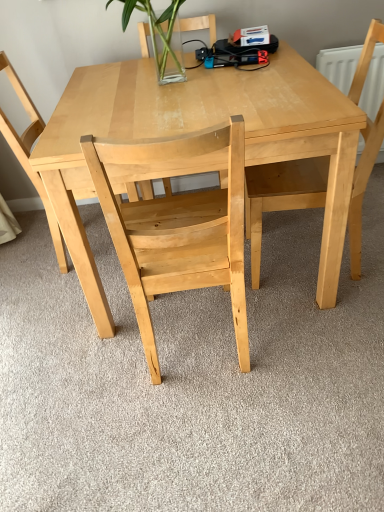
Image resolution: width=384 pixels, height=512 pixels. Describe the element at coordinates (199, 129) in the screenshot. I see `natural wood table at center` at that location.

Describe the element at coordinates (29, 153) in the screenshot. I see `natural wood chair at center, which appears as the first chair when viewed from the left` at that location.

What do you see at coordinates (281, 196) in the screenshot?
I see `natural wood chair at upper right, placed as the 3th chair when sorted from left to right` at bounding box center [281, 196].

Find the location of `natural wood chair at center, positioned as the 2th chair in right-to-left order`. natural wood chair at center, positioned as the 2th chair in right-to-left order is located at coordinates (177, 223).

Can you confirm if natural wood chair at center, which appears as the first chair when viewed from the left, is thinner than natural wood chair at upper right, placed as the first chair when sorted from right to left?

No.

Is natural wood chair at center, which appears as the first chair when viewed from the left, positioned with its back to natural wood chair at upper right, placed as the 3th chair when sorted from left to right?

No.

How many degrees apart are the facing directions of natural wood chair at center, the 3th chair viewed from the right, and natural wood chair at upper right, placed as the 3th chair when sorted from left to right?

The angle between the facing direction of natural wood chair at center, the 3th chair viewed from the right, and the facing direction of natural wood chair at upper right, placed as the 3th chair when sorted from left to right, is 179 degrees.

Between natural wood chair at upper right, placed as the 3th chair when sorted from left to right, and natural wood chair at center, positioned as the 2th chair in right-to-left order, which one appears on the right side from the viewer's perspective?

natural wood chair at upper right, placed as the 3th chair when sorted from left to right.

Are natural wood chair at upper right, placed as the 3th chair when sorted from left to right, and natural wood chair at center, positioned as the 2th chair in right-to-left order, far apart?

No, natural wood chair at upper right, placed as the 3th chair when sorted from left to right, is not far from natural wood chair at center, positioned as the 2th chair in right-to-left order.

Is natural wood chair at upper right, placed as the first chair when sorted from right to left, not within natural wood chair at center, the 2th chair viewed from the left?

That's correct, natural wood chair at upper right, placed as the first chair when sorted from right to left, is outside of natural wood chair at center, the 2th chair viewed from the left.

Does natural wood chair at upper right, placed as the first chair when sorted from right to left, have a greater width compared to natural wood chair at center, the 2th chair viewed from the left?

Yes.

From the image's perspective, which one is positioned lower, natural wood chair at center, positioned as the 2th chair in right-to-left order, or natural wood chair at center, the 3th chair viewed from the right?

natural wood chair at center, positioned as the 2th chair in right-to-left order, is shown below in the image.

Would you say natural wood chair at center, the 2th chair viewed from the left, is a long distance from natural wood chair at center, which appears as the first chair when viewed from the left?

natural wood chair at center, the 2th chair viewed from the left, is near natural wood chair at center, which appears as the first chair when viewed from the left, not far away.

Considering the sizes of natural wood chair at center, positioned as the 2th chair in right-to-left order, and natural wood chair at center, the 3th chair viewed from the right, in the image, is natural wood chair at center, positioned as the 2th chair in right-to-left order, wider or thinner than natural wood chair at center, the 3th chair viewed from the right,?

In the image, natural wood chair at center, positioned as the 2th chair in right-to-left order, appears to be more narrow than natural wood chair at center, the 3th chair viewed from the right.

From a real-world perspective, is natural wood chair at center, the 3th chair viewed from the right, positioned under natural wood chair at center, the 2th chair viewed from the left, based on gravity?

No, from a real-world perspective, natural wood chair at center, the 3th chair viewed from the right, is not under natural wood chair at center, the 2th chair viewed from the left.

Which is in front, natural wood chair at center, which appears as the first chair when viewed from the left, or natural wood chair at center, positioned as the 2th chair in right-to-left order?

Positioned in front is natural wood chair at center, positioned as the 2th chair in right-to-left order.

From the picture: What's the angular difference between natural wood chair at center, which appears as the first chair when viewed from the left, and natural wood chair at center, positioned as the 2th chair in right-to-left order,'s facing directions?

88.8 degrees separate the facing orientations of natural wood chair at center, which appears as the first chair when viewed from the left, and natural wood chair at center, positioned as the 2th chair in right-to-left order.

Does point (280, 157) come farther from viewer compared to point (11, 143)?

No, (280, 157) is closer to viewer.

From a real-world perspective, is natural wood table at center beneath natural wood chair at center, which appears as the first chair when viewed from the left?

Indeed, from a real-world perspective, natural wood table at center is positioned beneath natural wood chair at center, which appears as the first chair when viewed from the left.

Consider the image. Does natural wood table at center turn towards natural wood chair at center, which appears as the first chair when viewed from the left?

No.

Where is `table located in front of the natural wood chair at center, which appears as the first chair when viewed from the left`? The height and width of the screenshot is (512, 384). table located in front of the natural wood chair at center, which appears as the first chair when viewed from the left is located at coordinates (199, 129).

From the image's perspective, which is above, natural wood table at center or natural wood chair at upper right, placed as the 3th chair when sorted from left to right?

natural wood chair at upper right, placed as the 3th chair when sorted from left to right, from the image's perspective.

Measure the distance from natural wood table at center to natural wood chair at upper right, placed as the 3th chair when sorted from left to right.

They are 13.47 inches apart.

Which point is more forward, (349, 172) or (380, 24)?

The point (349, 172) is more forward.

Relative to natural wood chair at upper right, placed as the 3th chair when sorted from left to right, is natural wood table at center in front or behind?

natural wood table at center is positioned closer to the viewer than natural wood chair at upper right, placed as the 3th chair when sorted from left to right.

Is natural wood chair at upper right, placed as the 3th chair when sorted from left to right, bigger or smaller than natural wood table at center?

Considering their sizes, natural wood chair at upper right, placed as the 3th chair when sorted from left to right, takes up less space than natural wood table at center.

Based on their positions, is natural wood chair at upper right, placed as the first chair when sorted from right to left, located to the left or right of natural wood table at center?

Based on their positions, natural wood chair at upper right, placed as the first chair when sorted from right to left, is located to the right of natural wood table at center.

Could you measure the distance between natural wood chair at upper right, placed as the 3th chair when sorted from left to right, and natural wood table at center?

The distance of natural wood chair at upper right, placed as the 3th chair when sorted from left to right, from natural wood table at center is 13.47 inches.

Can we say natural wood chair at upper right, placed as the 3th chair when sorted from left to right, lies outside natural wood table at center?

No, most part of natural wood chair at upper right, placed as the 3th chair when sorted from left to right, lies within natural wood table at center.

From the natural wood chair at center, which appears as the first chair when viewed from the left, count 1st chairs forward and point to it. Please provide its 2D coordinates.

[(281, 196)]

The width and height of the screenshot is (384, 512). I want to click on the 1st chair counting from the left side of the natural wood chair at upper right, placed as the first chair when sorted from right to left, so click(x=177, y=223).

Which object lies further to the anchor point natural wood chair at center, positioned as the 2th chair in right-to-left order, natural wood chair at center, the 3th chair viewed from the right, or natural wood chair at upper right, placed as the first chair when sorted from right to left?

Among the two, natural wood chair at center, the 3th chair viewed from the right, is located further to natural wood chair at center, positioned as the 2th chair in right-to-left order.

Based on the photo, looking at the image, which one is located further to natural wood chair at center, the 2th chair viewed from the left, natural wood chair at center, the 3th chair viewed from the right, or natural wood table at center?

natural wood chair at center, the 3th chair viewed from the right, is positioned further to the anchor natural wood chair at center, the 2th chair viewed from the left.

Looking at the image, which one is located closer to natural wood table at center, natural wood chair at upper right, placed as the first chair when sorted from right to left, or natural wood chair at center, the 3th chair viewed from the right?

natural wood chair at upper right, placed as the first chair when sorted from right to left.

Which object lies further to the anchor point natural wood chair at center, the 3th chair viewed from the right, natural wood chair at upper right, placed as the 3th chair when sorted from left to right, or natural wood table at center?

The object further to natural wood chair at center, the 3th chair viewed from the right, is natural wood chair at upper right, placed as the 3th chair when sorted from left to right.

Based on their spatial positions, is natural wood table at center or natural wood chair at center, the 2th chair viewed from the left, further from natural wood chair at upper right, placed as the 3th chair when sorted from left to right?

natural wood chair at center, the 2th chair viewed from the left, is positioned further to the anchor natural wood chair at upper right, placed as the 3th chair when sorted from left to right.

Based on their spatial positions, is natural wood chair at center, which appears as the first chair when viewed from the left, or natural wood chair at center, the 2th chair viewed from the left, closer to natural wood chair at upper right, placed as the 3th chair when sorted from left to right?

natural wood chair at center, the 2th chair viewed from the left, is positioned closer to the anchor natural wood chair at upper right, placed as the 3th chair when sorted from left to right.

Estimate the real-world distances between objects in this image. Which object is further from natural wood chair at center, the 2th chair viewed from the left, natural wood table at center or natural wood chair at center, which appears as the first chair when viewed from the left?

natural wood chair at center, which appears as the first chair when viewed from the left, is positioned further to the anchor natural wood chair at center, the 2th chair viewed from the left.

From the image, which object appears to be farther from natural wood chair at upper right, placed as the 3th chair when sorted from left to right, natural wood table at center or natural wood chair at center, which appears as the first chair when viewed from the left?

Among the two, natural wood chair at center, which appears as the first chair when viewed from the left, is located further to natural wood chair at upper right, placed as the 3th chair when sorted from left to right.

I want to click on table between natural wood chair at center, the 2th chair viewed from the left, and natural wood chair at center, which appears as the first chair when viewed from the left, in the front-back direction, so click(199, 129).

Where is `table situated between natural wood chair at center, which appears as the first chair when viewed from the left, and natural wood chair at upper right, placed as the first chair when sorted from right to left, from left to right`? This screenshot has height=512, width=384. table situated between natural wood chair at center, which appears as the first chair when viewed from the left, and natural wood chair at upper right, placed as the first chair when sorted from right to left, from left to right is located at coordinates (199, 129).

Find the location of a particular element. table between natural wood chair at center, the 2th chair viewed from the left, and natural wood chair at upper right, placed as the 3th chair when sorted from left to right is located at coordinates (199, 129).

Locate an element on the screen. Image resolution: width=384 pixels, height=512 pixels. chair located between natural wood chair at center, which appears as the first chair when viewed from the left, and natural wood chair at upper right, placed as the 3th chair when sorted from left to right, in the left-right direction is located at coordinates (177, 223).